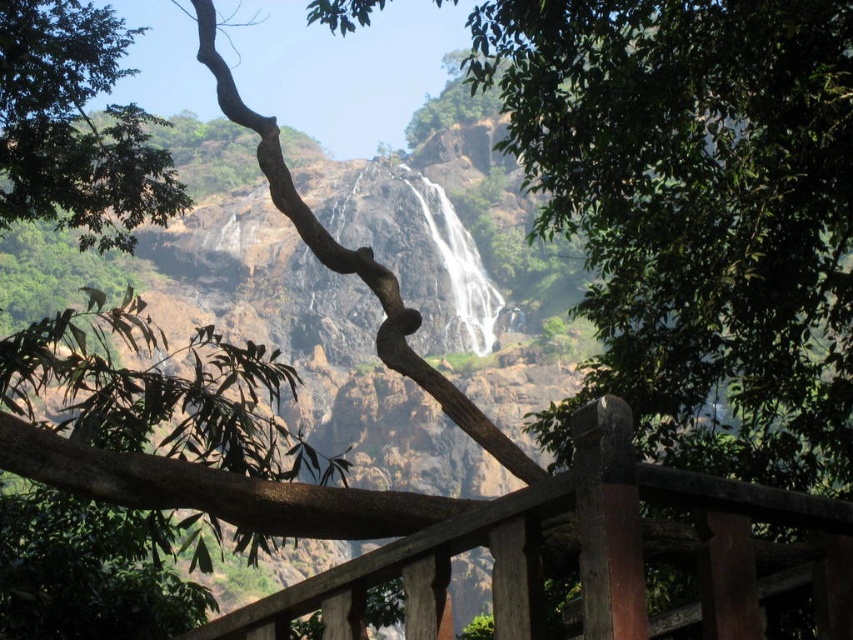
Who is shorter, brown wooden fence at center or green leafy tree at upper left?

With less height is brown wooden fence at center.

How far apart are brown wooden fence at center and green leafy tree at upper left?

53.12 meters

Is point (821, 524) closer to viewer compared to point (169, 170)?

Yes, it is.

You are a GUI agent. You are given a task and a screenshot of the screen. Output one action in this format:
    pyautogui.click(x=<x>, y=<y>)
    Task: Click on the brown wooden fence at center
    
    Given the screenshot: What is the action you would take?
    pyautogui.click(x=579, y=552)